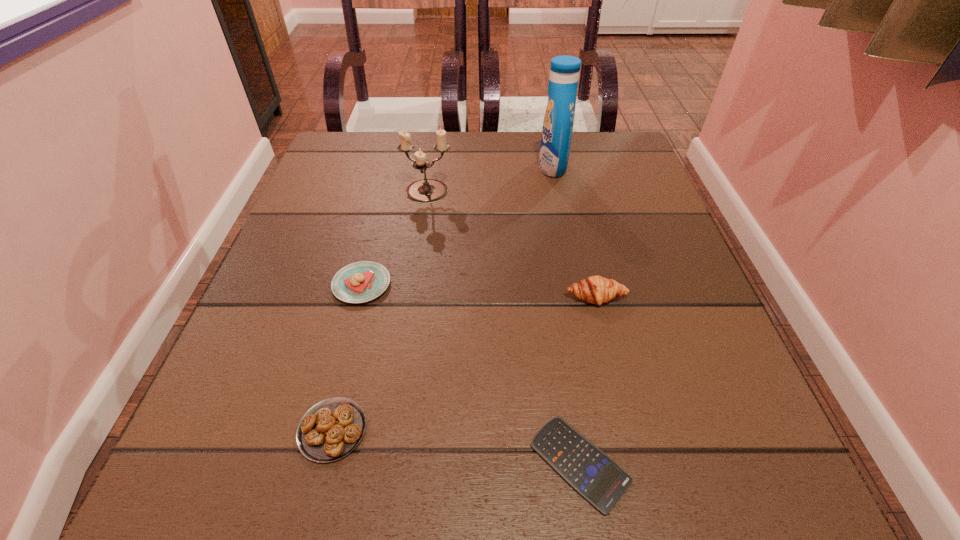
I want to click on empty location between the tallest object and the second shortest object, so click(x=443, y=299).

Locate an element on the screen. This screenshot has height=540, width=960. vacant space in between the second shortest object and the calculator is located at coordinates (456, 447).

Locate an element on the screen. This screenshot has height=540, width=960. free space between the tallest pastry and the second shortest pastry is located at coordinates (479, 291).

The width and height of the screenshot is (960, 540). Identify the location of free space between the rightmost pastry and the fourth tallest object. (479, 291).

This screenshot has height=540, width=960. Find the location of `vacant region between the calculator and the detergent`. vacant region between the calculator and the detergent is located at coordinates (566, 315).

Where is `free space between the rightmost pastry and the detergent`? free space between the rightmost pastry and the detergent is located at coordinates (574, 232).

Find the location of a particular element. The height and width of the screenshot is (540, 960). free space between the detergent and the nearest pastry is located at coordinates (443, 299).

Locate an element on the screen. The width and height of the screenshot is (960, 540). unoccupied area between the second tallest object and the rightmost pastry is located at coordinates (512, 245).

I want to click on object that is the third closest one to the rightmost pastry, so click(424, 191).

Find the location of a particular element. The height and width of the screenshot is (540, 960). object that is the fifth closest one to the rightmost pastry is located at coordinates (331, 429).